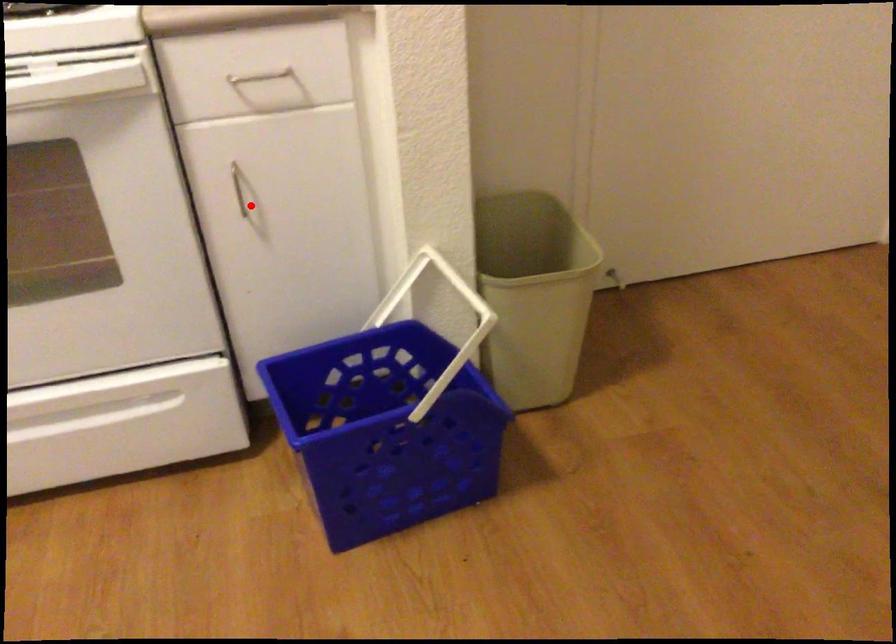
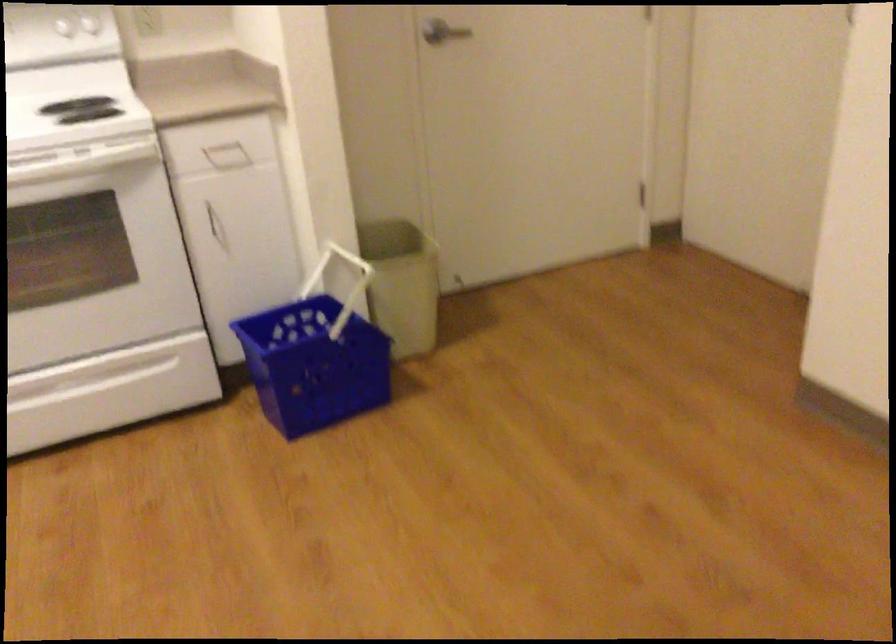
Question: A red point is marked in image1. In image2, is the corresponding 3D point closer to the camera or farther? Reply with the corresponding letter.

Choices:
 (A) The corresponding 3D point is closer.
 (B) The corresponding 3D point is farther.

Answer: (B)